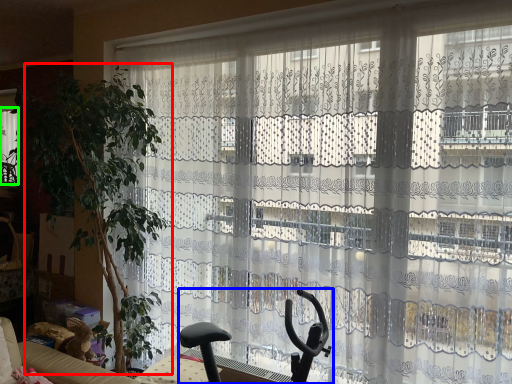
Question: Which object is positioned farthest from plant (highlighted by a red box)? Select from swivel chair (highlighted by a blue box) and window (highlighted by a green box).

Choices:
 (A) swivel chair
 (B) window

Answer: (B)